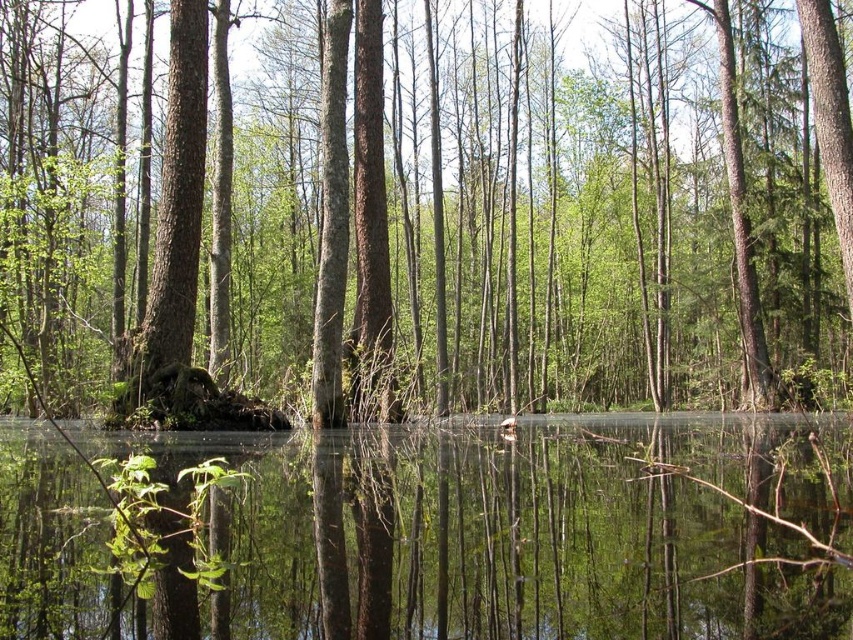
You are a photographer wanting to capture the reflection of the green matte tree at center in the clear water at center. Is the tree reflected in the water?

The green matte tree at center is positioned over clear water at center, so its reflection would be visible in the water.

You are standing in the forest looking at the water. There are two points marked in the scene. The first point is at coordinates point (352, 403) and the second is at point (643, 422). Which point is closer to you?

Point (352, 403) is closer to the viewer than point (643, 422).